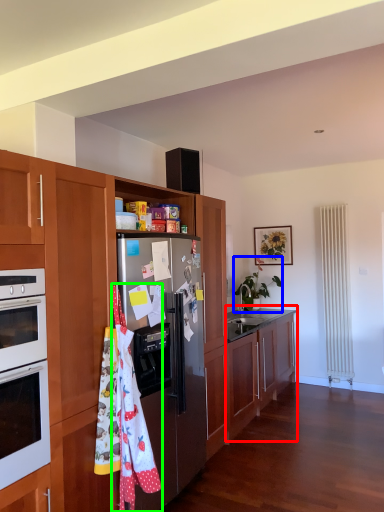
Question: Based on their relative distances, which object is farther from cabinetry (highlighted by a red box)? Choose from houseplant (highlighted by a blue box) and material (highlighted by a green box).

Choices:
 (A) houseplant
 (B) material

Answer: (B)